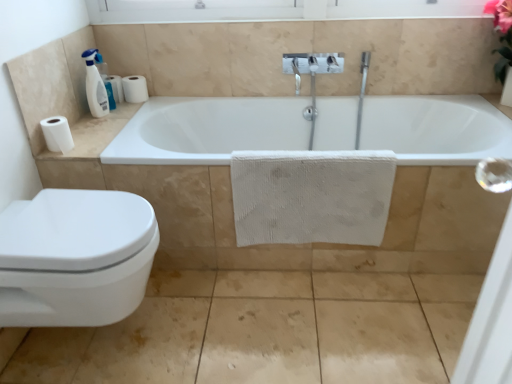
Image resolution: width=512 pixels, height=384 pixels. What are the coordinates of `vacant region below white glossy toilet at lower left (from a real-world perspective)` in the screenshot? It's located at (102, 340).